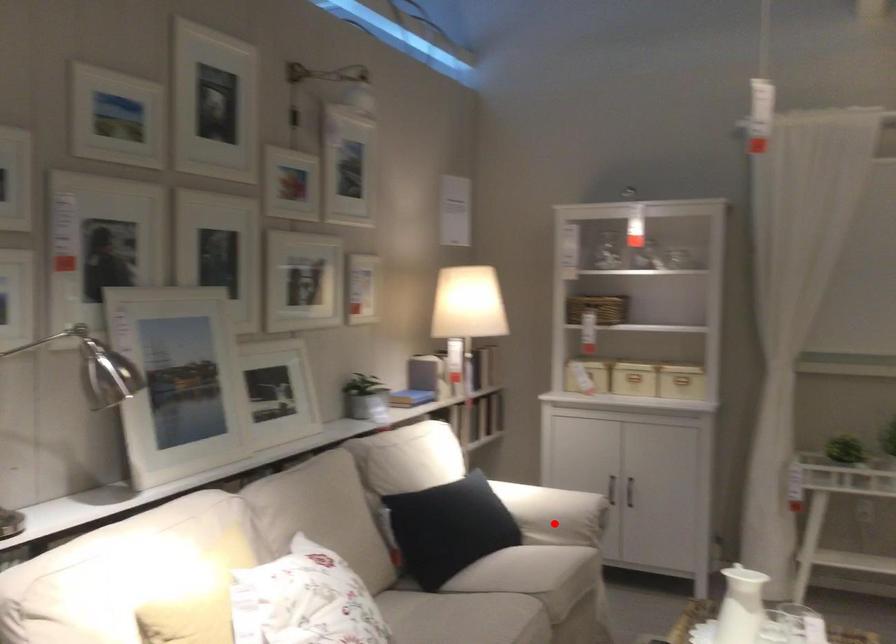
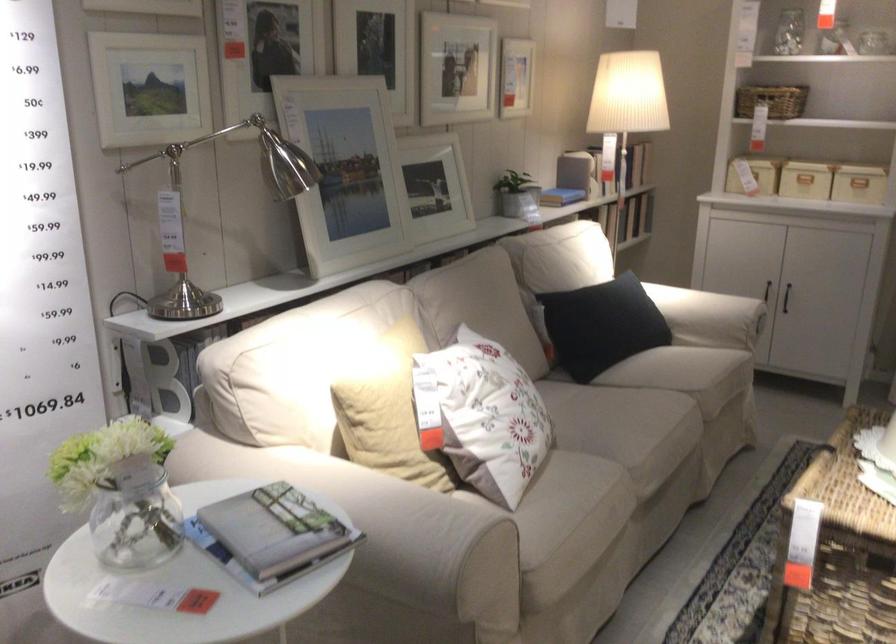
Locate, in the second image, the point that corresponds to the highlighted location in the first image.

(709, 317)